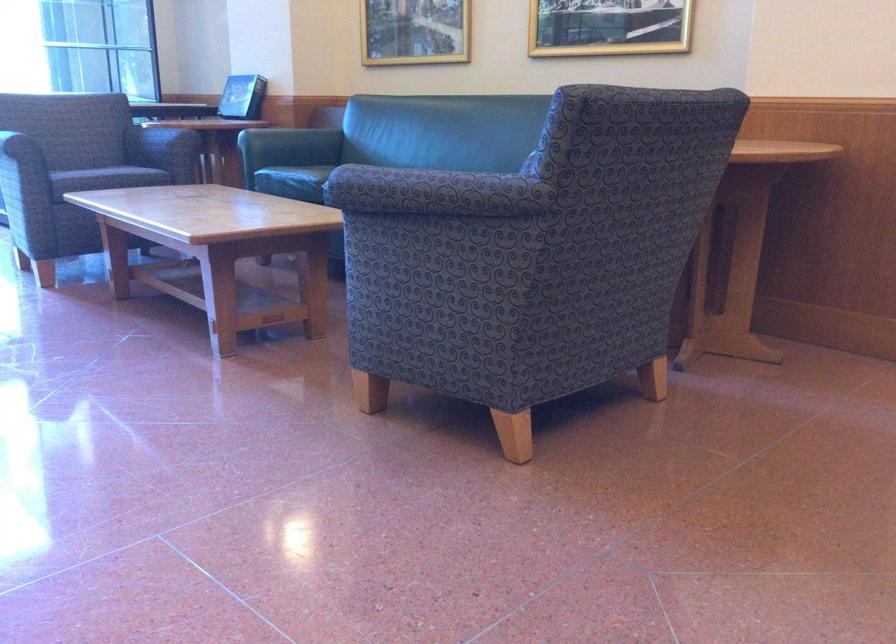
The image size is (896, 644). What are the coordinates of `sofa armrest` in the screenshot? It's located at (x=290, y=145).